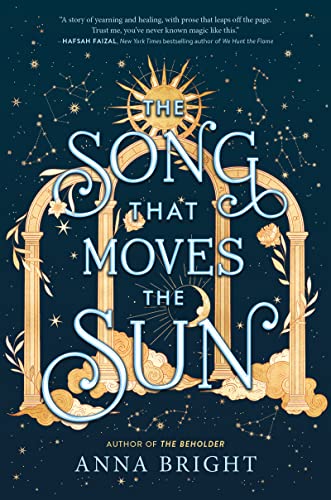
I want to click on column, so [220, 304].